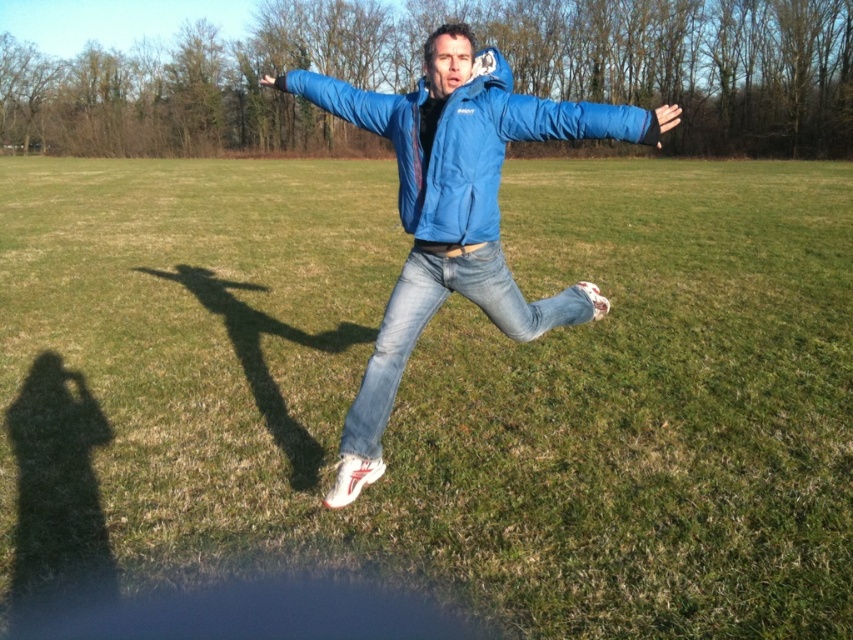
You are a photographer trying to capture a jumping person in a grassy field. You notice the blue synthetic jacket at center and the jeans at center. Which piece of clothing is positioned higher in the image?

The blue synthetic jacket at center is positioned higher in the image because it is closer to the viewer than the jeans at center.

You are a fashion designer analyzing the image of a person wearing two jackets. The blue matte jacket at center and the blue synthetic jacket at center are both visible. Which jacket is positioned lower on the person?

The blue matte jacket at center is located below the blue synthetic jacket at center, so it is positioned lower on the person.